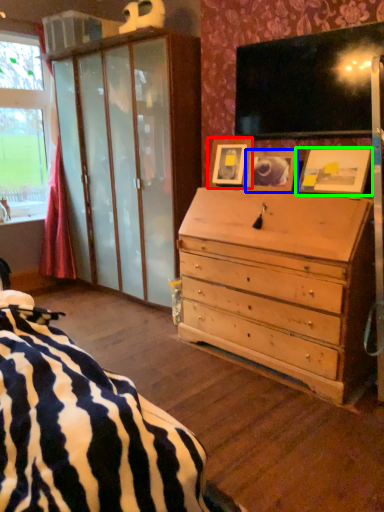
Question: Which object is the farthest from picture frame (highlighted by a red box)? Choose among these: picture frame (highlighted by a blue box) or picture frame (highlighted by a green box).

Choices:
 (A) picture frame
 (B) picture frame

Answer: (B)